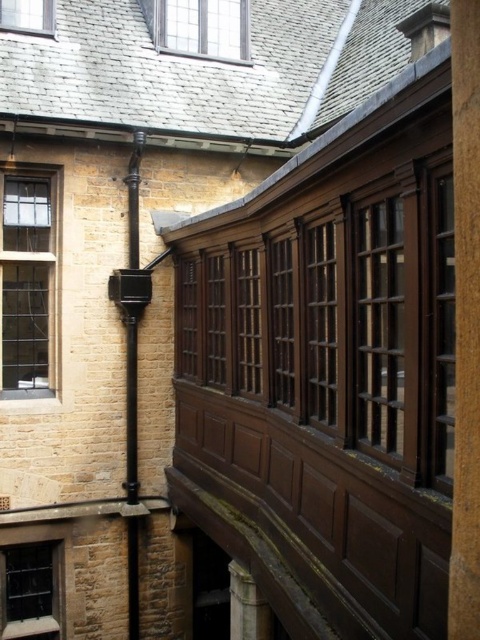
Question: Does brown wood pillar at center lie behind clear glass window at upper center?

Choices:
 (A) yes
 (B) no

Answer: (B)

Question: Based on their relative distances, which object is farther from the clear glass window at upper left?

Choices:
 (A) clear glass window at left
 (B) clear glass window at upper center
 (C) brown wood pillar at center
 (D) matte glass window at lower left

Answer: (C)

Question: Does brown wood pillar at center appear on the left side of clear glass window at left?

Choices:
 (A) no
 (B) yes

Answer: (A)

Question: Which point is farther from the camera taking this photo?

Choices:
 (A) (21, 273)
 (B) (206, 29)

Answer: (B)

Question: Does clear glass window at upper center come behind clear glass window at upper left?

Choices:
 (A) yes
 (B) no

Answer: (A)

Question: Considering the real-world distances, which object is farthest from the matte glass window at lower left?

Choices:
 (A) clear glass window at left
 (B) clear glass window at upper left
 (C) brown wood pillar at center

Answer: (B)